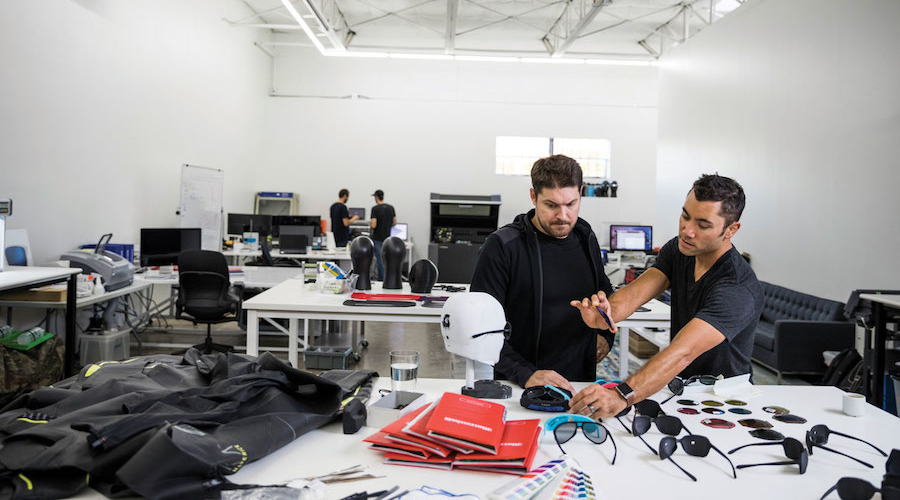
In order to click on ceiling rails in this screenshot , I will do [x=568, y=36], [x=327, y=37], [x=451, y=28], [x=682, y=37].